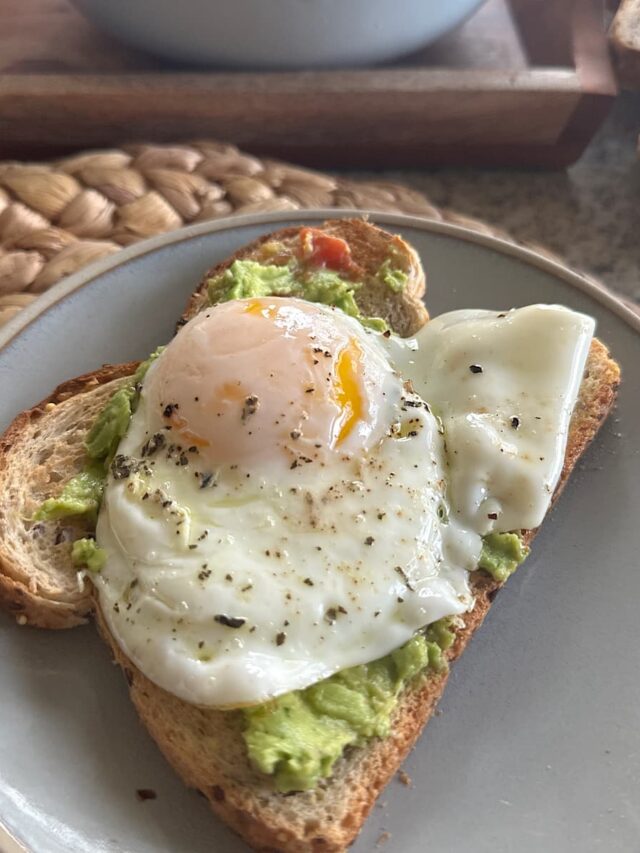
Identify the location of serving tray. The image size is (640, 853). (484, 107).